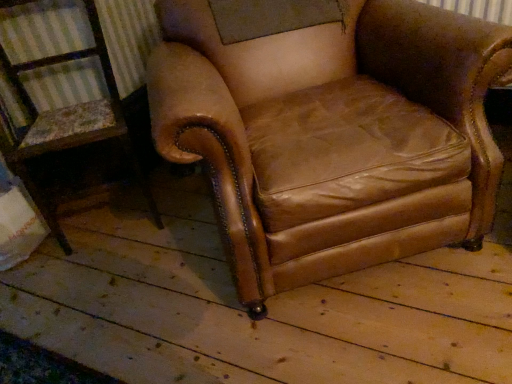
In the scene shown: What is the approximate width of brown leather armchair at center, which is the 2th chair in right-to-left order?

17.97 inches.

Measure the distance between point (57, 55) and camera.

The depth of point (57, 55) is 5.27 feet.

Locate an element on the screen. brown leather armchair at center, which is the 2th chair in right-to-left order is located at coordinates (72, 123).

This screenshot has height=384, width=512. Describe the element at coordinates (72, 123) in the screenshot. I see `brown leather armchair at center, which is the 1th chair from left to right` at that location.

The image size is (512, 384). In order to click on brown leather armchair at center, which is counted as the second chair, starting from the left in this screenshot , I will do `click(330, 129)`.

This screenshot has width=512, height=384. What do you see at coordinates (330, 129) in the screenshot?
I see `brown leather armchair at center, marked as the 1th chair in a right-to-left arrangement` at bounding box center [330, 129].

Locate an element on the screen. brown leather armchair at center, which is the 1th chair from left to right is located at coordinates (72, 123).

Is brown leather armchair at center, which is the 2th chair in right-to-left order, to the left of brown leather armchair at center, which is counted as the second chair, starting from the left, from the viewer's perspective?

Correct, you'll find brown leather armchair at center, which is the 2th chair in right-to-left order, to the left of brown leather armchair at center, which is counted as the second chair, starting from the left.

In the image, is brown leather armchair at center, which is the 1th chair from left to right, positioned in front of or behind brown leather armchair at center, marked as the 1th chair in a right-to-left arrangement?

Visually, brown leather armchair at center, which is the 1th chair from left to right, is located behind brown leather armchair at center, marked as the 1th chair in a right-to-left arrangement.

Considering the positions of points (121, 121) and (263, 207), is point (121, 121) farther from camera compared to point (263, 207)?

Yes, it is.

From the image's perspective, is brown leather armchair at center, which is the 1th chair from left to right, over brown leather armchair at center, marked as the 1th chair in a right-to-left arrangement?

Incorrect, from the image's perspective, brown leather armchair at center, which is the 1th chair from left to right, is lower than brown leather armchair at center, marked as the 1th chair in a right-to-left arrangement.

From a real-world perspective, is brown leather armchair at center, which is the 2th chair in right-to-left order, below brown leather armchair at center, which is counted as the second chair, starting from the left?

Indeed, from a real-world perspective, brown leather armchair at center, which is the 2th chair in right-to-left order, is positioned beneath brown leather armchair at center, which is counted as the second chair, starting from the left.

Considering the sizes of objects brown leather armchair at center, which is the 1th chair from left to right, and brown leather armchair at center, which is counted as the second chair, starting from the left, in the image provided, who is thinner, brown leather armchair at center, which is the 1th chair from left to right, or brown leather armchair at center, which is counted as the second chair, starting from the left,?

brown leather armchair at center, which is the 1th chair from left to right.

Considering the sizes of brown leather armchair at center, which is the 2th chair in right-to-left order, and brown leather armchair at center, marked as the 1th chair in a right-to-left arrangement, in the image, is brown leather armchair at center, which is the 2th chair in right-to-left order, taller or shorter than brown leather armchair at center, marked as the 1th chair in a right-to-left arrangement,?

Clearly, brown leather armchair at center, which is the 2th chair in right-to-left order, is shorter compared to brown leather armchair at center, marked as the 1th chair in a right-to-left arrangement.

Considering the relative sizes of brown leather armchair at center, which is the 2th chair in right-to-left order, and brown leather armchair at center, which is counted as the second chair, starting from the left, in the image provided, is brown leather armchair at center, which is the 2th chair in right-to-left order, bigger than brown leather armchair at center, which is counted as the second chair, starting from the left,?

No, brown leather armchair at center, which is the 2th chair in right-to-left order, is not bigger than brown leather armchair at center, which is counted as the second chair, starting from the left.

Choose the correct answer: Is brown leather armchair at center, which is the 1th chair from left to right, inside brown leather armchair at center, which is counted as the second chair, starting from the left, or outside it?

The correct answer is: outside.

Can you see brown leather armchair at center, which is the 2th chair in right-to-left order, touching brown leather armchair at center, which is counted as the second chair, starting from the left?

No, brown leather armchair at center, which is the 2th chair in right-to-left order, is not making contact with brown leather armchair at center, which is counted as the second chair, starting from the left.

Does brown leather armchair at center, which is the 2th chair in right-to-left order, turn towards brown leather armchair at center, which is counted as the second chair, starting from the left?

No, brown leather armchair at center, which is the 2th chair in right-to-left order, is not facing towards brown leather armchair at center, which is counted as the second chair, starting from the left.

How different are the orientations of brown leather armchair at center, which is the 2th chair in right-to-left order, and brown leather armchair at center, which is counted as the second chair, starting from the left, in degrees?

The facing directions of brown leather armchair at center, which is the 2th chair in right-to-left order, and brown leather armchair at center, which is counted as the second chair, starting from the left, are 5.04 degrees apart.

The width and height of the screenshot is (512, 384). What are the coordinates of `chair that is below the brown leather armchair at center, marked as the 1th chair in a right-to-left arrangement (from the image's perspective)` in the screenshot? It's located at (72, 123).

Is brown leather armchair at center, which is counted as the second chair, starting from the left, at the right side of brown leather armchair at center, which is the 1th chair from left to right?

Indeed, brown leather armchair at center, which is counted as the second chair, starting from the left, is positioned on the right side of brown leather armchair at center, which is the 1th chair from left to right.

Is brown leather armchair at center, marked as the 1th chair in a right-to-left arrangement, closer to camera compared to brown leather armchair at center, which is the 1th chair from left to right?

That is True.

Is point (224, 129) positioned before point (98, 119)?

Yes, it is in front of point (98, 119).

From the image's perspective, does brown leather armchair at center, marked as the 1th chair in a right-to-left arrangement, appear lower than brown leather armchair at center, which is the 1th chair from left to right?

No, from the image's perspective, brown leather armchair at center, marked as the 1th chair in a right-to-left arrangement, is not beneath brown leather armchair at center, which is the 1th chair from left to right.

From a real-world perspective, is brown leather armchair at center, marked as the 1th chair in a right-to-left arrangement, positioned under brown leather armchair at center, which is the 2th chair in right-to-left order, based on gravity?

No, from a real-world perspective, brown leather armchair at center, marked as the 1th chair in a right-to-left arrangement, is not under brown leather armchair at center, which is the 2th chair in right-to-left order.

Considering the sizes of objects brown leather armchair at center, marked as the 1th chair in a right-to-left arrangement, and brown leather armchair at center, which is the 2th chair in right-to-left order, in the image provided, who is thinner, brown leather armchair at center, marked as the 1th chair in a right-to-left arrangement, or brown leather armchair at center, which is the 2th chair in right-to-left order,?

With smaller width is brown leather armchair at center, which is the 2th chair in right-to-left order.

Between brown leather armchair at center, marked as the 1th chair in a right-to-left arrangement, and brown leather armchair at center, which is the 1th chair from left to right, which one has more height?

With more height is brown leather armchair at center, marked as the 1th chair in a right-to-left arrangement.

Can you confirm if brown leather armchair at center, marked as the 1th chair in a right-to-left arrangement, is smaller than brown leather armchair at center, which is the 1th chair from left to right?

No.

Choose the correct answer: Is brown leather armchair at center, marked as the 1th chair in a right-to-left arrangement, inside brown leather armchair at center, which is the 1th chair from left to right, or outside it?

brown leather armchair at center, marked as the 1th chair in a right-to-left arrangement, is outside brown leather armchair at center, which is the 1th chair from left to right.

From the picture: Is brown leather armchair at center, which is counted as the second chair, starting from the left, directly adjacent to brown leather armchair at center, which is the 1th chair from left to right?

No, brown leather armchair at center, which is counted as the second chair, starting from the left, is not with brown leather armchair at center, which is the 1th chair from left to right.

Is brown leather armchair at center, marked as the 1th chair in a right-to-left arrangement, positioned with its back to brown leather armchair at center, which is the 1th chair from left to right?

No, brown leather armchair at center, marked as the 1th chair in a right-to-left arrangement,'s orientation is not away from brown leather armchair at center, which is the 1th chair from left to right.

In the scene shown: What's the angular difference between brown leather armchair at center, marked as the 1th chair in a right-to-left arrangement, and brown leather armchair at center, which is the 1th chair from left to right,'s facing directions?

5.04 degrees separate the facing orientations of brown leather armchair at center, marked as the 1th chair in a right-to-left arrangement, and brown leather armchair at center, which is the 1th chair from left to right.

Find the location of a particular element. chair on the left of brown leather armchair at center, marked as the 1th chair in a right-to-left arrangement is located at coordinates (72, 123).

The width and height of the screenshot is (512, 384). I want to click on chair lying below the brown leather armchair at center, marked as the 1th chair in a right-to-left arrangement (from the image's perspective), so click(72, 123).

Image resolution: width=512 pixels, height=384 pixels. I want to click on chair above the brown leather armchair at center, which is the 1th chair from left to right (from a real-world perspective), so click(x=330, y=129).